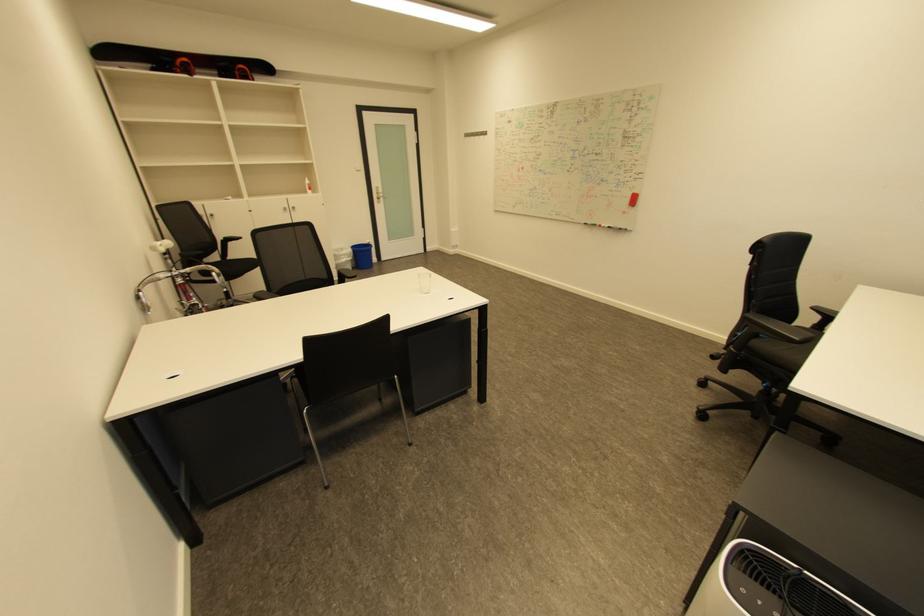
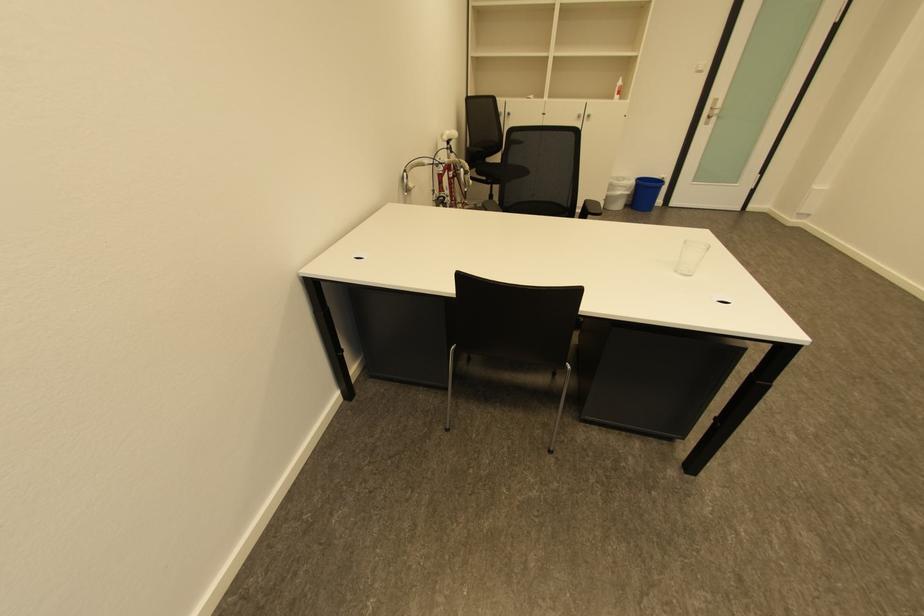
Find the pixel in the second image that matches the point at 429,294 in the first image.

(684, 272)